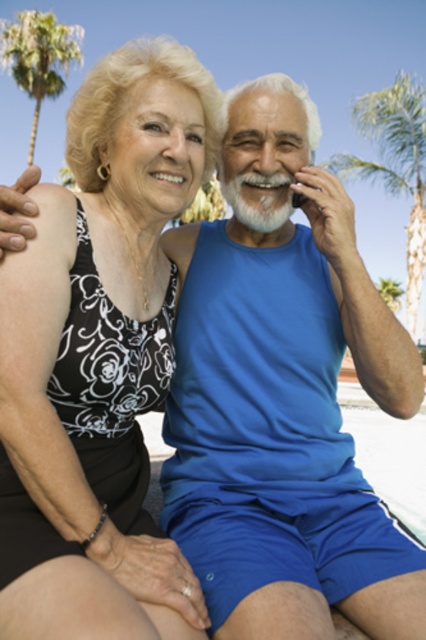
Question: Which of the following is the closest to the observer?

Choices:
 (A) (230, 461)
 (B) (68, 163)
 (C) (28, 17)

Answer: (A)

Question: From the image, what is the correct spatial relationship of blue fabric tank top at center in relation to black floral tank top at upper left?

Choices:
 (A) above
 (B) below

Answer: (B)

Question: Is blue fabric tank top at center to the right of black floral tank top at upper left from the viewer's perspective?

Choices:
 (A) no
 (B) yes

Answer: (B)

Question: Is black floral tank top at upper left smaller than green leafy palm tree at upper left?

Choices:
 (A) no
 (B) yes

Answer: (B)

Question: Among these points, which one is nearest to the camera?

Choices:
 (A) (184, 460)
 (B) (31, 145)
 (C) (127, 579)

Answer: (C)

Question: Which object is the closest to the blue fabric tank top at center?

Choices:
 (A) green leafy palm tree at upper left
 (B) black floral tank top at upper left

Answer: (B)